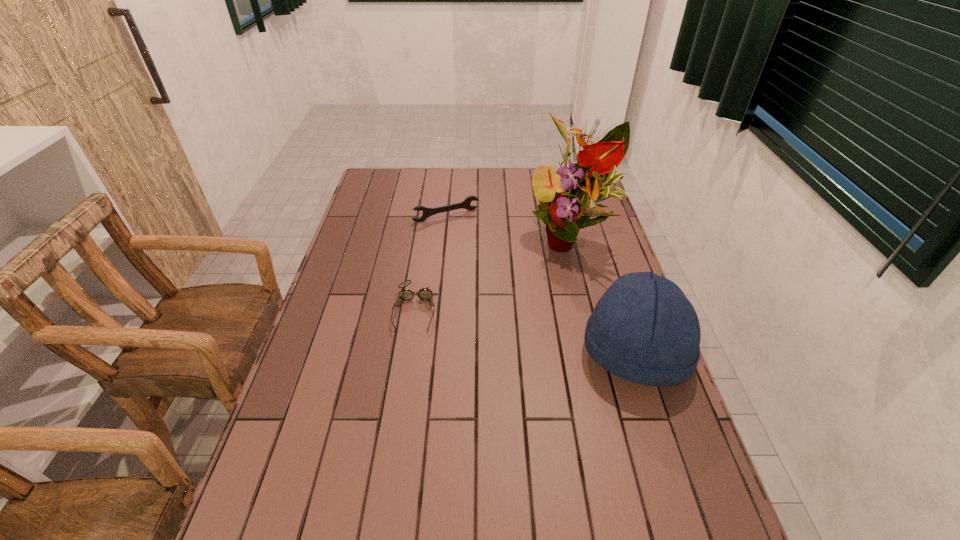
This screenshot has height=540, width=960. I want to click on vacant space situated 0.300m on the open ends of the wrench, so click(x=490, y=274).

Locate an element on the screen. vacant region located 0.300m on the open ends of the wrench is located at coordinates (490, 274).

Identify the location of skullcap that is at the right edge. (643, 329).

At what (x,y) coordinates should I click in order to perform the action: click on bouquet at the right edge. Please return your answer as a coordinate pair (x, y). The height and width of the screenshot is (540, 960). Looking at the image, I should click on (568, 195).

Locate an element on the screen. This screenshot has height=540, width=960. blank space at the far edge is located at coordinates (509, 185).

Identify the location of vacant region at the left edge of the desktop. The height and width of the screenshot is (540, 960). (322, 430).

In the image, there is a desktop. Where is `free space at the right edge`? This screenshot has width=960, height=540. free space at the right edge is located at coordinates (696, 456).

This screenshot has height=540, width=960. In the image, there is a desktop. What are the coordinates of `vacant space at the far left corner` in the screenshot? It's located at (372, 179).

Identify the location of empty space between the third shortest object and the shortest object. This screenshot has height=540, width=960. (525, 332).

Find the location of a particular element. This screenshot has height=540, width=960. vacant space that is in between the second tallest object and the shortest object is located at coordinates (525, 332).